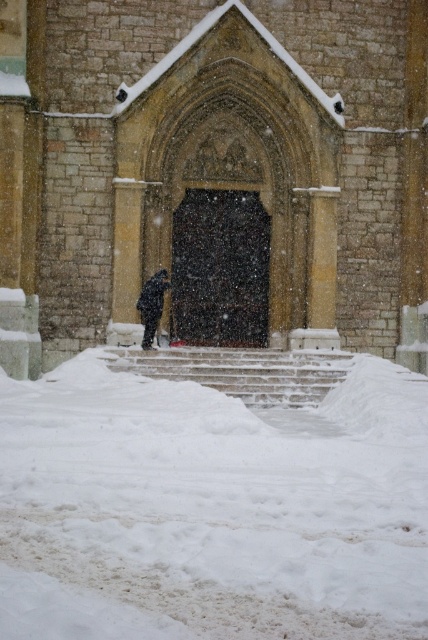
Consider the image. Who is more forward, [103,262] or [145,298]?

Positioned in front is point [145,298].

Can you confirm if brown stone church at center is taller than black matte coat at center?

Yes.

Between point (2, 317) and point (142, 314), which one is positioned behind?

Point (142, 314)

Image resolution: width=428 pixels, height=640 pixels. In order to click on brown stone church at center in this screenshot , I will do `click(216, 172)`.

Between white fluffy snow at center and snow-covered stone stairs at center, which one is positioned higher?

snow-covered stone stairs at center is higher up.

Who is taller, white fluffy snow at center or snow-covered stone stairs at center?

white fluffy snow at center

Where is `white fluffy snow at center`? white fluffy snow at center is located at coordinates (211, 508).

Image resolution: width=428 pixels, height=640 pixels. What are the coordinates of `white fluffy snow at center` in the screenshot? It's located at pos(211,508).

Between point (300, 273) and point (222, 353), which one is positioned behind?

Positioned behind is point (300, 273).

Is brown stone church at center taller than snow-covered stone stairs at center?

Correct, brown stone church at center is much taller as snow-covered stone stairs at center.

Who is more distant from viewer, (x=306, y=256) or (x=166, y=362)?

The point (x=306, y=256) is behind.

You are a GUI agent. You are given a task and a screenshot of the screen. Output one action in this format:
    pyautogui.click(x=<x>, y=<y>)
    Task: Click on the brown stone church at center
    
    Given the screenshot: What is the action you would take?
    pyautogui.click(x=216, y=172)